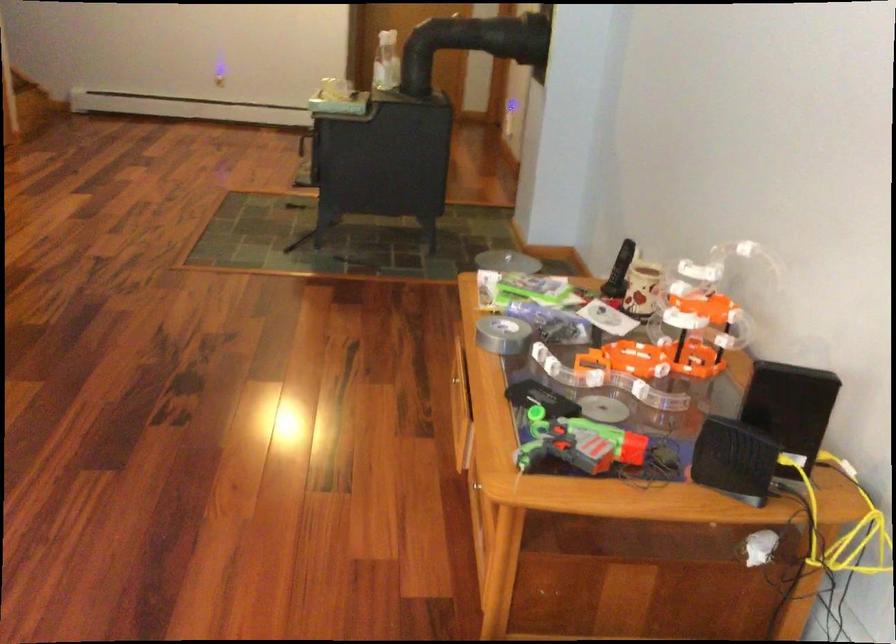
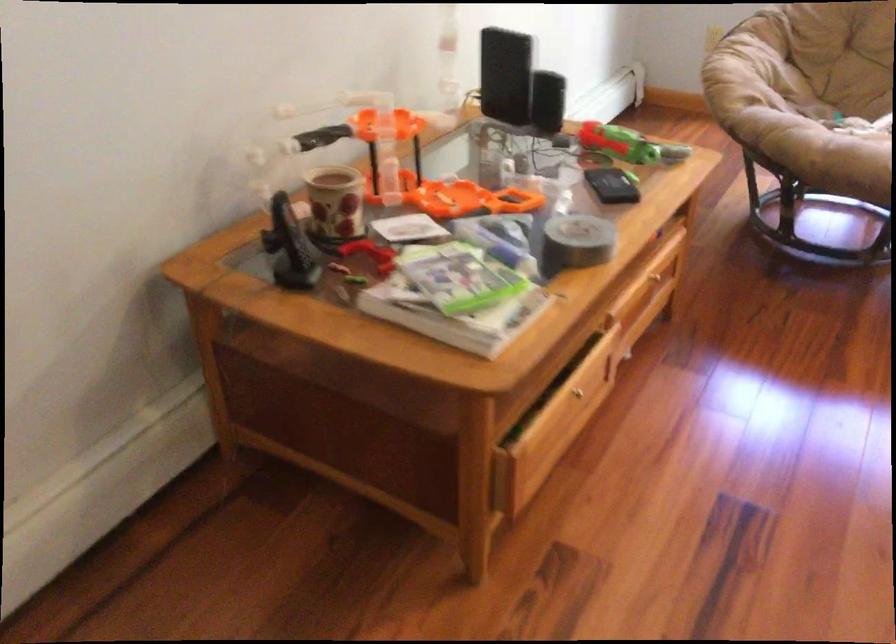
Locate, in the second image, the point that corresponds to the point at 625,361 in the first image.

(470, 199)